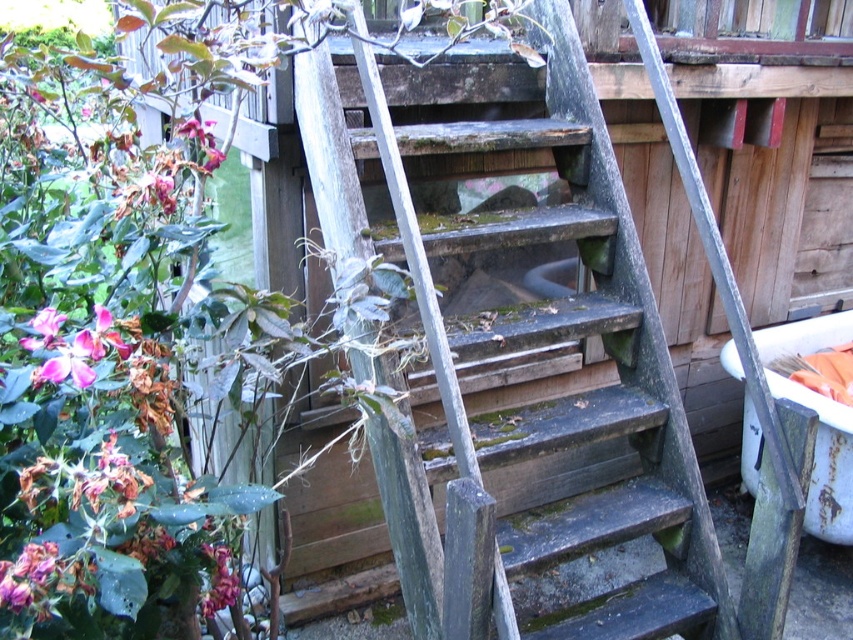
Can you confirm if pink matte flower at left is smaller than pink matte flower at lower left?

Indeed, pink matte flower at left has a smaller size compared to pink matte flower at lower left.

Where is `pink matte flower at left`? The width and height of the screenshot is (853, 640). pink matte flower at left is located at coordinates (73, 346).

Which of these two, white plastic tub at right or pink matte flower at lower left, stands taller?

white plastic tub at right

Is white plastic tub at right taller than pink matte flower at lower left?

Indeed, white plastic tub at right has a greater height compared to pink matte flower at lower left.

At what (x,y) coordinates should I click in order to perform the action: click on white plastic tub at right. Please return your answer as a coordinate pair (x, y). Looking at the image, I should click on (817, 420).

This screenshot has width=853, height=640. I want to click on white plastic tub at right, so click(817, 420).

Does weathered wood ladder at center lie in front of pink matte flower at left?

No.

Between weathered wood ladder at center and pink matte flower at left, which one has less height?

pink matte flower at left is shorter.

Locate an element on the screen. weathered wood ladder at center is located at coordinates (519, 339).